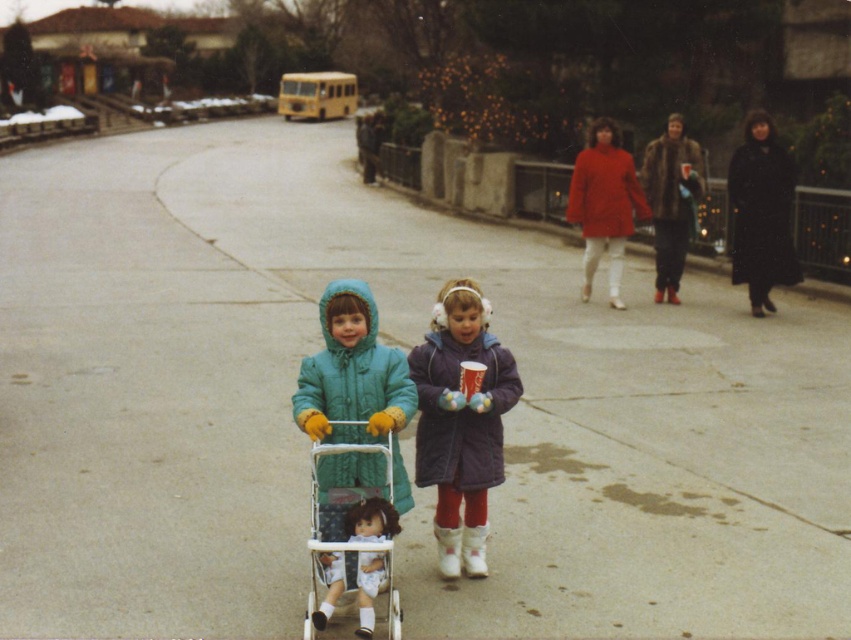
Is point (458, 536) positioned after point (312, 577)?

Yes.

This screenshot has width=851, height=640. I want to click on purple matte coat at center, so click(x=460, y=422).